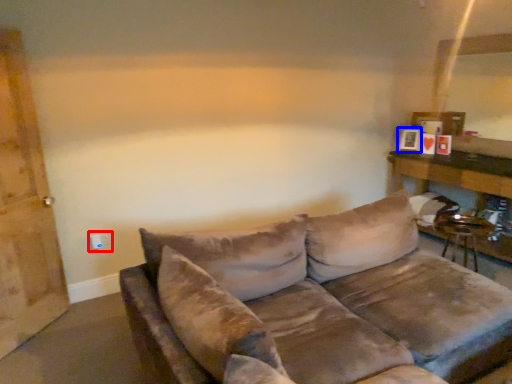
Question: Which object appears closest to the camera in this image, electric outlet (highlighted by a red box) or picture frame (highlighted by a blue box)?

Choices:
 (A) electric outlet
 (B) picture frame

Answer: (A)